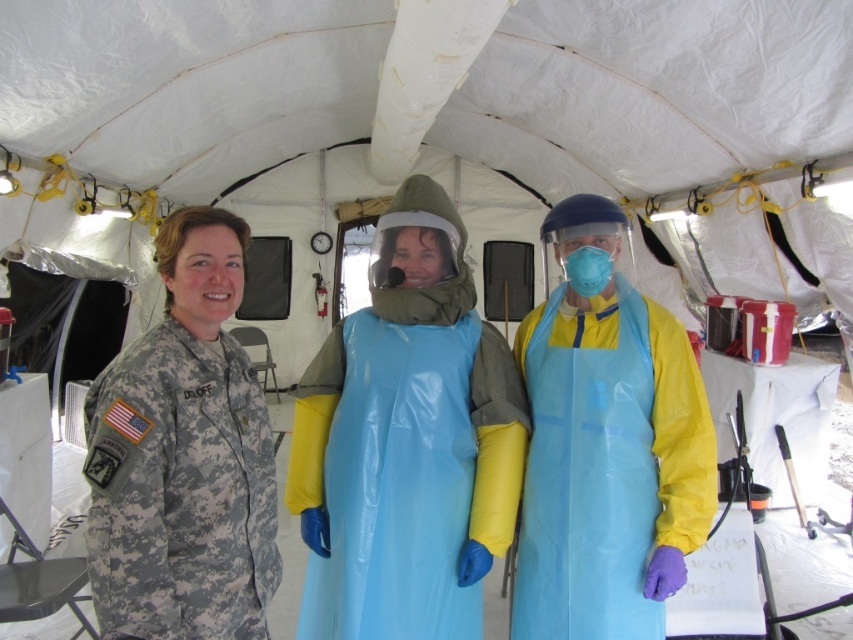
You are a photographer standing outside the medical tent. You want to take a photo of both the camouflage uniform at left and the blue matte face mask at center. Which of the two will appear larger in the photo?

The camouflage uniform at left will appear larger in the photo because it is much taller than the blue matte face mask at center.

You are a healthcare worker in the tent and need to determine which of the two items, the camouflage uniform at left or the blue plastic apron at center, is more suitable for a task requiring flexibility of movement. Based on their physical characteristics, which one would you choose?

The camouflage uniform at left is thinner than the blue plastic apron at center, so it would be more flexible and allow for easier movement. Therefore, the camouflage uniform at left is more suitable for tasks requiring flexibility of movement.

You are a drone operator trying to locate the camouflage uniform at left in the medical tent. The tent has a coordinate system where the bottom left corner is the origin point. The coordinates of the camouflage uniform at left are given as point (x=183, y=456). What is the direction of the camouflage uniform at left relative to the center of the tent?

The camouflage uniform at left is located at point (x=183, y=456). Since the coordinate system starts at the bottom left corner, the x value of 0.714 indicates it is 71.4 percent from the left edge towards the right, and the y value of 0.216 means it is 21.6 percent from the bottom edge upwards. Therefore, the camouflage uniform at left is positioned towards the upper right direction from the center of the tent.